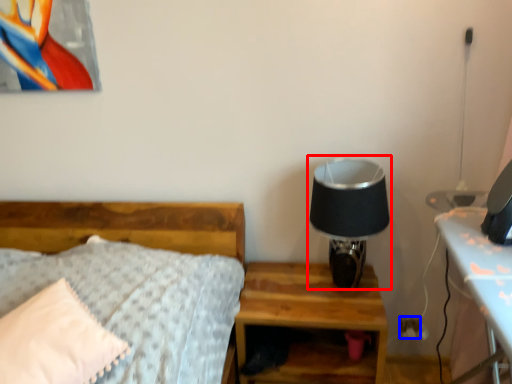
Question: Which object appears farthest to the camera in this image, table lamp (highlighted by a red box) or electric outlet (highlighted by a blue box)?

Choices:
 (A) table lamp
 (B) electric outlet

Answer: (B)